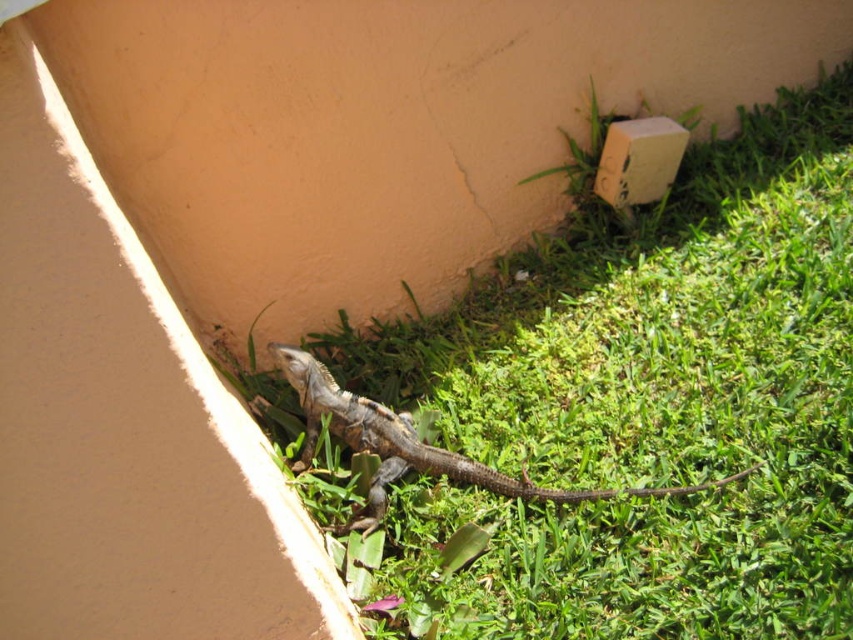
Which is more to the left, brown scaly lizard at lower center or beige cardboard box at upper right?

From the viewer's perspective, brown scaly lizard at lower center appears more on the left side.

Who is lower down, brown scaly lizard at lower center or beige cardboard box at upper right?

Positioned lower is brown scaly lizard at lower center.

Image resolution: width=853 pixels, height=640 pixels. What are the coordinates of `brown scaly lizard at lower center` in the screenshot? It's located at (408, 444).

The width and height of the screenshot is (853, 640). I want to click on brown scaly lizard at lower center, so click(408, 444).

Who is positioned more to the right, green grass at lower center or beige cardboard box at upper right?

Positioned to the right is green grass at lower center.

Is green grass at lower center further to camera compared to beige cardboard box at upper right?

No, it is not.

Is point (550, 576) in front of point (616, 205)?

Yes, it is in front of point (616, 205).

Locate an element on the screen. This screenshot has height=640, width=853. green grass at lower center is located at coordinates (641, 408).

Is green grass at lower center to the right of brown scaly lizard at lower center from the viewer's perspective?

Correct, you'll find green grass at lower center to the right of brown scaly lizard at lower center.

What do you see at coordinates (641, 408) in the screenshot? The image size is (853, 640). I see `green grass at lower center` at bounding box center [641, 408].

Locate an element on the screen. green grass at lower center is located at coordinates (641, 408).